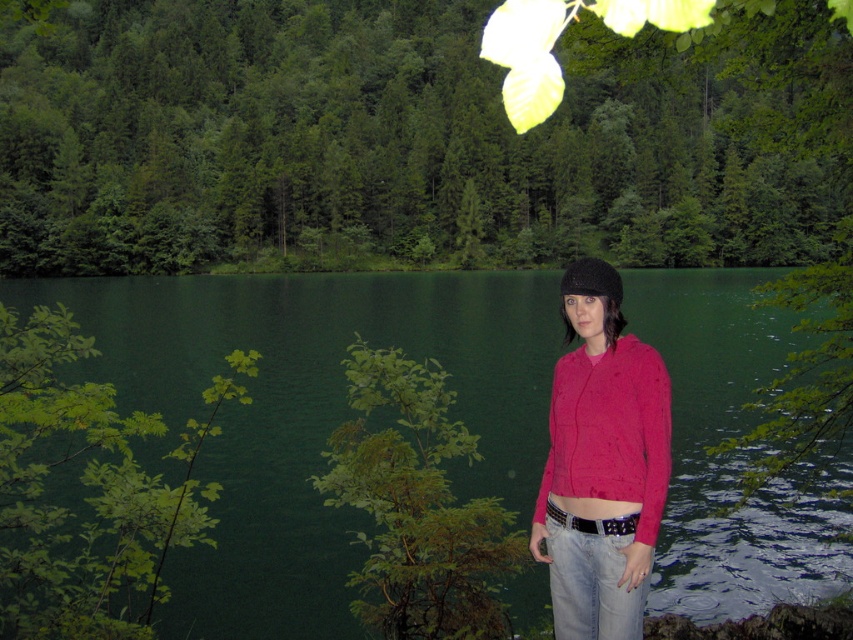
Question: Is green leafy tree at upper center smaller than green leafy bush at lower left?

Choices:
 (A) yes
 (B) no

Answer: (B)

Question: Is green liquid water at center below black fuzzy hat at center?

Choices:
 (A) no
 (B) yes

Answer: (A)

Question: Which object appears closest to the camera in this image?

Choices:
 (A) green leafy bush at lower left
 (B) green leafy tree at upper center
 (C) green liquid water at center

Answer: (B)

Question: Can you confirm if green liquid water at center is positioned to the left of green leafy branch at left?

Choices:
 (A) no
 (B) yes

Answer: (A)

Question: Which object is positioned closest to the green liquid water at center?

Choices:
 (A) pink cotton sweater at center
 (B) green leafy bush at lower left

Answer: (B)

Question: Among these objects, which one is nearest to the camera?

Choices:
 (A) pink cotton sweater at center
 (B) green leafy bush at lower left
 (C) green liquid water at center

Answer: (A)